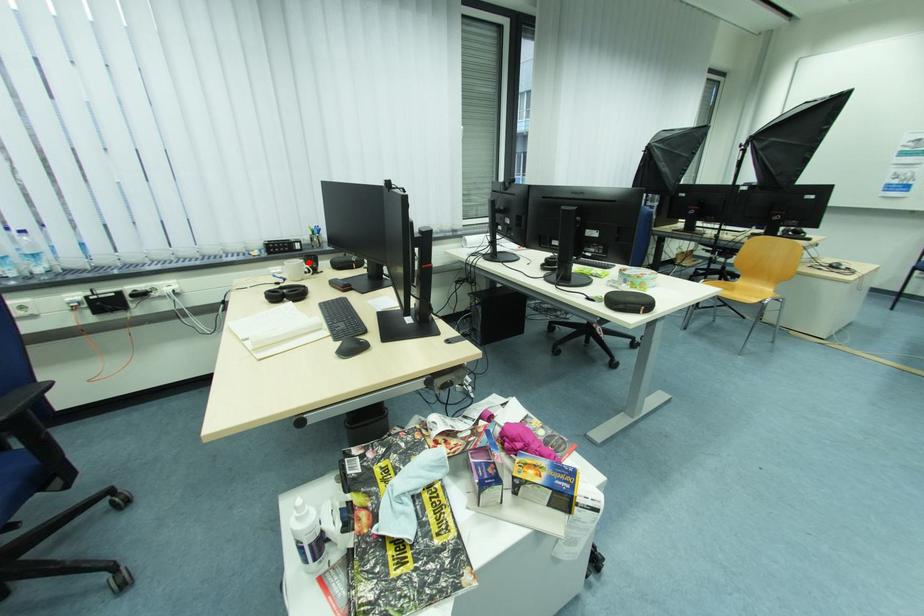
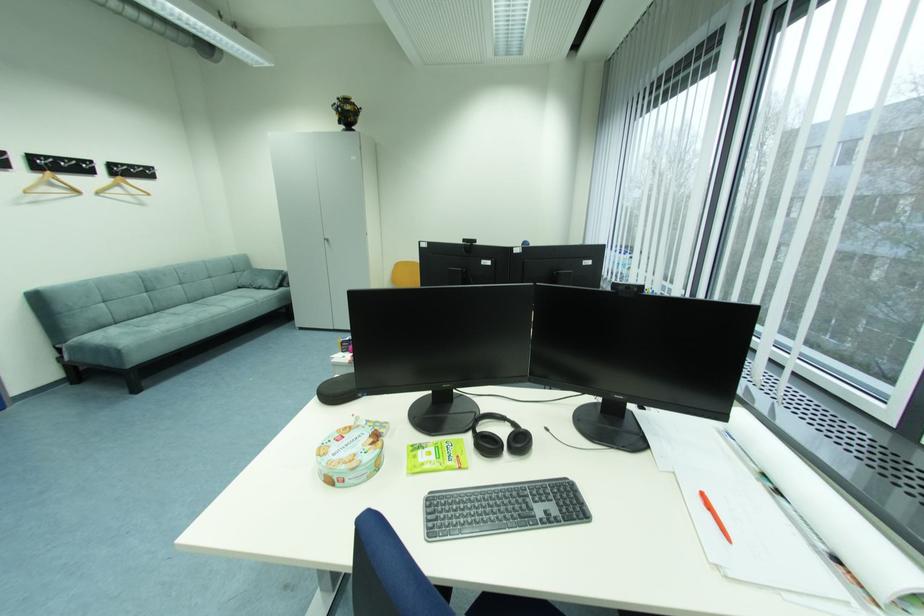
Question: I am providing you with two images of the same scene from different viewpoints. A red point is marked on the first image. Can you still see the location of the red point in image 2?

Choices:
 (A) Yes
 (B) No

Answer: (B)